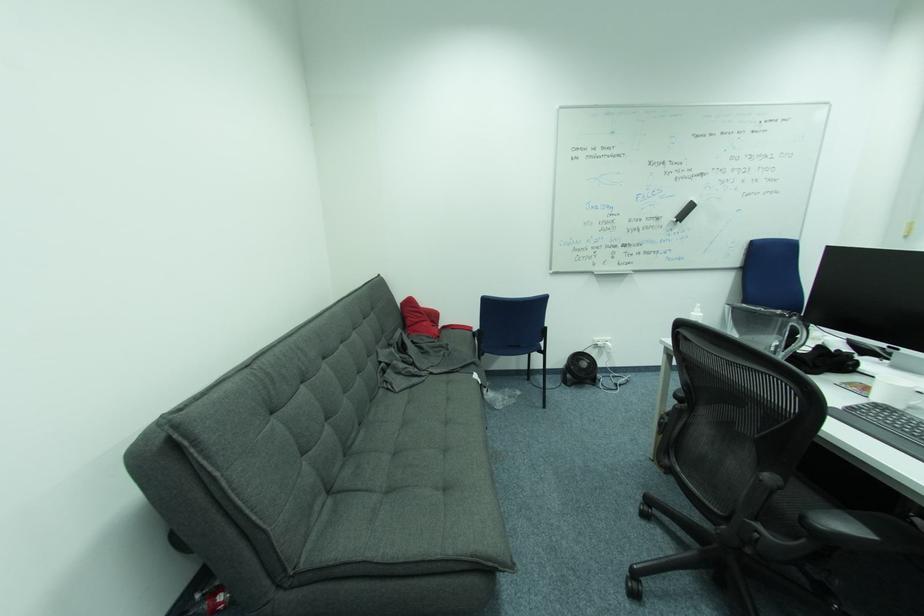
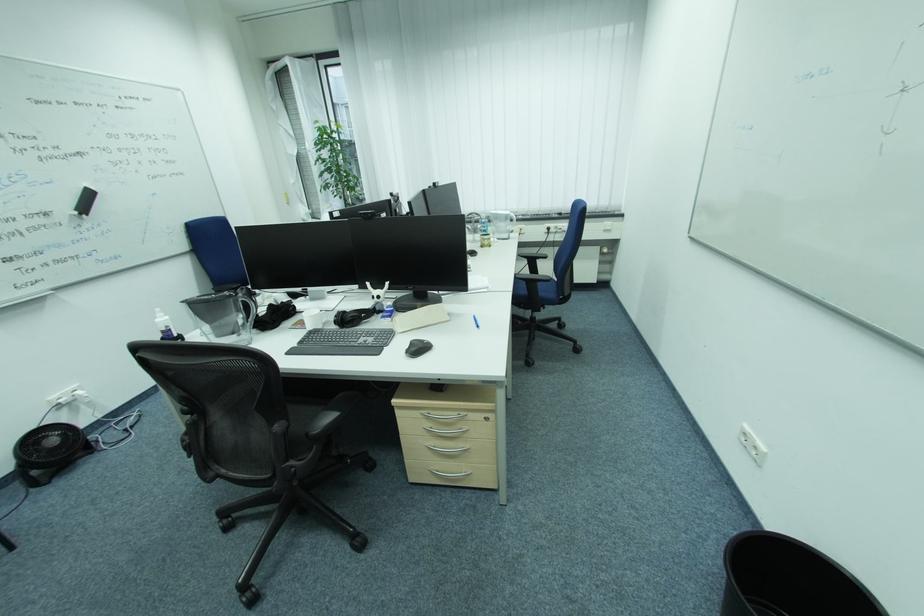
The point at (786, 488) is marked in the first image. Where is the corresponding point in the second image?

(294, 429)